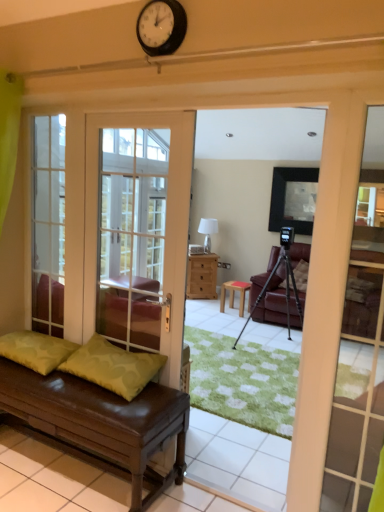
Image resolution: width=384 pixels, height=512 pixels. What do you see at coordinates (293, 199) in the screenshot? I see `matte black frame at upper center` at bounding box center [293, 199].

What do you see at coordinates (233, 294) in the screenshot?
I see `wooden stool at center` at bounding box center [233, 294].

Identify the location of wooden stool at center. The height and width of the screenshot is (512, 384). (233, 294).

I want to click on white glossy lampshade at center, so click(208, 231).

What do you see at coordinates (100, 418) in the screenshot? This screenshot has width=384, height=512. I see `brown leather bench at lower left` at bounding box center [100, 418].

At what (x,y) coordinates should I click in order to perform the action: click on clear glass door at left. Please return your answer as a coordinate pair (x, y). The image size is (384, 512). Looking at the image, I should click on (48, 224).

The image size is (384, 512). I want to click on matte black frame at upper center, so pyautogui.click(x=293, y=199).

Does white glass door at left have a greater height compared to clear glass door at left?

Indeed, white glass door at left has a greater height compared to clear glass door at left.

In the scene shown: Does white glass door at left appear on the right side of clear glass door at left?

Yes.

How many degrees apart are the facing directions of white glass door at left and clear glass door at left?

The facing directions of white glass door at left and clear glass door at left are 0.224 degrees apart.

From the picture: From the image's perspective, is white glass door at left above clear glass door at left?

No, from the image's perspective, white glass door at left is not over clear glass door at left.

Based on their sizes in the image, would you say green fabric pillow at lower left, which ranks as the first pillow in right-to-left order, is bigger or smaller than white glossy lampshade at center?

green fabric pillow at lower left, which ranks as the first pillow in right-to-left order, is bigger than white glossy lampshade at center.

In the image, there is a green fabric pillow at lower left, which ranks as the first pillow in right-to-left order. Identify the location of lamp above it (from the image's perspective). (208, 231).

Is green fabric pillow at lower left, positioned as the second pillow in left-to-right order, positioned beyond the bounds of white glossy lampshade at center?

green fabric pillow at lower left, positioned as the second pillow in left-to-right order, lies outside white glossy lampshade at center's area.

Is green fabric pillow at lower left, which ranks as the first pillow in right-to-left order, turned away from white glossy lampshade at center?

Yes.

From a real-world perspective, who is located lower, white glossy lampshade at center or green textured pillow at lower left, the 2th pillow positioned from the right?

In real-world perspective, green textured pillow at lower left, the 2th pillow positioned from the right, is lower.

Does point (210, 232) appear closer or farther from the camera than point (43, 358)?

Point (210, 232) is farther from the camera than point (43, 358).

Considering the relative sizes of white glossy lampshade at center and green textured pillow at lower left, the first pillow positioned from the left, in the image provided, is white glossy lampshade at center shorter than green textured pillow at lower left, the first pillow positioned from the left,?

Incorrect, the height of white glossy lampshade at center does not fall short of that of green textured pillow at lower left, the first pillow positioned from the left.

Which point is more distant from viewer, [111,428] or [184,20]?

The point [111,428] is farther from the camera.

Is brown leather bench at lower left beside white face clock at upper center?

brown leather bench at lower left and white face clock at upper center are not in contact.

Considering the relative sizes of brown leather bench at lower left and white face clock at upper center in the image provided, is brown leather bench at lower left thinner than white face clock at upper center?

In fact, brown leather bench at lower left might be wider than white face clock at upper center.

Identify the location of clock that appears above the brown leather bench at lower left (from the image's perspective). (161, 27).

Considering the points (208, 242) and (56, 411), which point is in front, point (208, 242) or point (56, 411)?

Positioned in front is point (56, 411).

From the image's perspective, which one is positioned lower, white glossy lampshade at center or brown leather bench at lower left?

brown leather bench at lower left.

Is white glossy lampshade at center beside brown leather bench at lower left?

white glossy lampshade at center and brown leather bench at lower left are clearly separated.

Considering the sizes of objects white glossy lampshade at center and matte black frame at upper center in the image provided, who is smaller, white glossy lampshade at center or matte black frame at upper center?

white glossy lampshade at center.

Visually, is white glossy lampshade at center positioned to the left or to the right of matte black frame at upper center?

white glossy lampshade at center is positioned on matte black frame at upper center's left side.

Considering the sizes of white glossy lampshade at center and matte black frame at upper center in the image, is white glossy lampshade at center taller or shorter than matte black frame at upper center?

Considering their sizes, white glossy lampshade at center has less height than matte black frame at upper center.

Is white glossy lampshade at center further to the viewer compared to matte black frame at upper center?

Yes, the depth of white glossy lampshade at center is greater than that of matte black frame at upper center.

Considering the sizes of clear glass door at left and wooden stool at center in the image, is clear glass door at left bigger or smaller than wooden stool at center?

Clearly, clear glass door at left is larger in size than wooden stool at center.

Is point (63, 287) in front of point (234, 288)?

Yes, point (63, 287) is in front of point (234, 288).

Is there a large distance between clear glass door at left and wooden stool at center?

Yes, clear glass door at left is far from wooden stool at center.

You are a GUI agent. You are given a task and a screenshot of the screen. Output one action in this format:
    pyautogui.click(x=<x>, y=<y>)
    Task: Click on the door that appears below the clear glass door at left (from a real-world perspective)
    The height and width of the screenshot is (512, 384).
    Given the screenshot: What is the action you would take?
    pyautogui.click(x=166, y=220)

You are a GUI agent. You are given a task and a screenshot of the screen. Output one action in this format:
    pyautogui.click(x=<x>, y=<y>)
    Task: Click on the lamp above the green fabric pillow at lower left, which ranks as the first pillow in right-to-left order (from the image's perspective)
    
    Given the screenshot: What is the action you would take?
    [208, 231]

Considering their positions, is green textured pillow at lower left, the 2th pillow positioned from the right, positioned further to green fabric pillow at lower left, positioned as the second pillow in left-to-right order, than white glass door at left?

white glass door at left is positioned further to the anchor green fabric pillow at lower left, positioned as the second pillow in left-to-right order.

Consider the image. Considering their positions, is white face clock at upper center positioned closer to white glass door at left than wooden stool at center?

Among the two, white face clock at upper center is located nearer to white glass door at left.

From the image, which object appears to be nearer to white glossy lampshade at center, green fabric pillow at lower left, which ranks as the first pillow in right-to-left order, or brown leather bench at lower left?

green fabric pillow at lower left, which ranks as the first pillow in right-to-left order.

When comparing their distances from green textured pillow at lower left, the 2th pillow positioned from the right, does wooden stool at center or clear glass door at left seem closer?

Based on the image, clear glass door at left appears to be nearer to green textured pillow at lower left, the 2th pillow positioned from the right.

Which object lies further to the anchor point leather couch at center, brown leather bench at lower left or green textured pillow at lower left, the 2th pillow positioned from the right?

green textured pillow at lower left, the 2th pillow positioned from the right, is further to leather couch at center.

Based on their spatial positions, is green textured pillow at lower left, the first pillow positioned from the left, or leather couch at center further from matte black frame at upper center?

green textured pillow at lower left, the first pillow positioned from the left, lies further to matte black frame at upper center than the other object.

Looking at the image, which one is located further to matte black frame at upper center, green textured pillow at lower left, the first pillow positioned from the left, or white glass door at left?

The object further to matte black frame at upper center is green textured pillow at lower left, the first pillow positioned from the left.

From the image, which object appears to be nearer to white glass door at left, white face clock at upper center or green textured pillow at lower left, the 2th pillow positioned from the right?

green textured pillow at lower left, the 2th pillow positioned from the right.

Find the location of a particular element. The height and width of the screenshot is (512, 384). door between brown leather bench at lower left and wooden stool at center along the z-axis is located at coordinates (166, 220).

This screenshot has height=512, width=384. What are the coordinates of `glass door between green fabric pillow at lower left, positioned as the second pillow in left-to-right order, and wooden stool at center, along the z-axis` in the screenshot? It's located at (48, 224).

This screenshot has width=384, height=512. I want to click on desk between white face clock at upper center and matte black frame at upper center from front to back, so click(100, 418).

The image size is (384, 512). Identify the location of glass door positioned between white face clock at upper center and wooden stool at center from near to far. (48, 224).